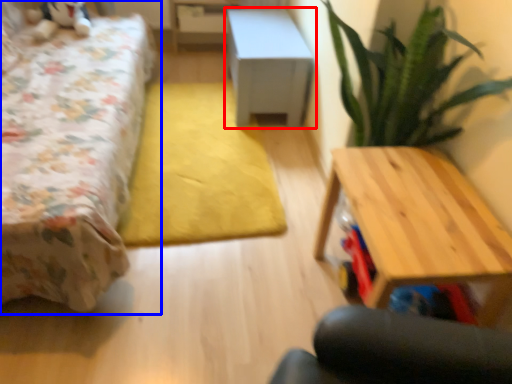
Question: Which object is closer to the camera taking this photo, table (highlighted by a red box) or bed (highlighted by a blue box)?

Choices:
 (A) table
 (B) bed

Answer: (B)